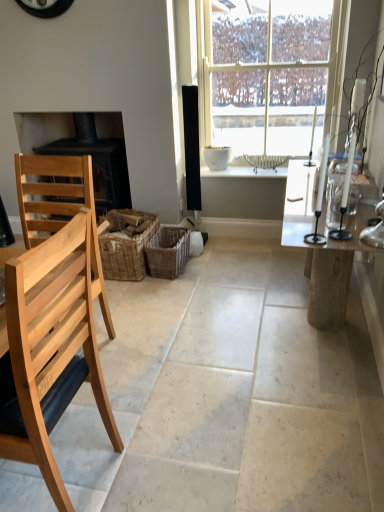
Question: Is clear glass table at right closer to the viewer compared to woven brown basket at center, the 1th crate positioned from the right?

Choices:
 (A) no
 (B) yes

Answer: (B)

Question: From the image's perspective, does clear glass table at right appear lower than woven brown basket at center, the 1th crate positioned from the right?

Choices:
 (A) no
 (B) yes

Answer: (A)

Question: Is clear glass table at right taller than woven brown basket at center, the 1th crate positioned from the right?

Choices:
 (A) yes
 (B) no

Answer: (A)

Question: Is clear glass table at right beside woven brown basket at center, the 1th crate positioned from the right?

Choices:
 (A) yes
 (B) no

Answer: (B)

Question: Is woven brown basket at center, arranged as the 2th crate when viewed from the left, surrounded by clear glass table at right?

Choices:
 (A) no
 (B) yes

Answer: (A)

Question: Considering the relative positions of woven brown basket at center, which ranks as the 1th crate in left-to-right order, and black matte fireplace at left in the image provided, is woven brown basket at center, which ranks as the 1th crate in left-to-right order, to the left or to the right of black matte fireplace at left?

Choices:
 (A) left
 (B) right

Answer: (B)

Question: Based on their sizes in the image, would you say woven brown basket at center, which appears as the 2th crate when viewed from the right, is bigger or smaller than black matte fireplace at left?

Choices:
 (A) small
 (B) big

Answer: (A)

Question: Looking at their shapes, would you say woven brown basket at center, which ranks as the 1th crate in left-to-right order, is wider or thinner than black matte fireplace at left?

Choices:
 (A) wide
 (B) thin

Answer: (A)

Question: From the image's perspective, is woven brown basket at center, which appears as the 2th crate when viewed from the right, positioned above or below black matte fireplace at left?

Choices:
 (A) below
 (B) above

Answer: (A)

Question: From the image's perspective, is natural wood chair at left, acting as the second chair starting from the back, positioned above or below black matte fireplace at left?

Choices:
 (A) below
 (B) above

Answer: (A)

Question: In the image, is natural wood chair at left, acting as the second chair starting from the back, on the left side or the right side of black matte fireplace at left?

Choices:
 (A) right
 (B) left

Answer: (A)

Question: Is natural wood chair at left, acting as the second chair starting from the back, in front of or behind black matte fireplace at left in the image?

Choices:
 (A) behind
 (B) front

Answer: (B)

Question: Looking at the image, does natural wood chair at left, the first chair when ordered from front to back, seem bigger or smaller compared to black matte fireplace at left?

Choices:
 (A) big
 (B) small

Answer: (B)

Question: Would you say black matte fireplace at left is to the left or to the right of woven brown basket at center, arranged as the 2th crate when viewed from the left, in the picture?

Choices:
 (A) left
 (B) right

Answer: (A)

Question: Relative to woven brown basket at center, the 1th crate positioned from the right, is black matte fireplace at left in front or behind?

Choices:
 (A) front
 (B) behind

Answer: (B)